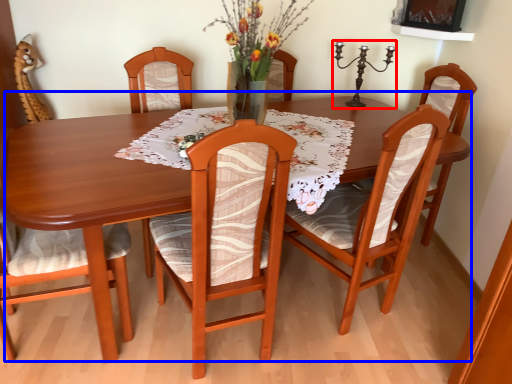
Question: Which object appears farthest to the camera in this image, candle holder (highlighted by a red box) or kitchen & dining room table (highlighted by a blue box)?

Choices:
 (A) candle holder
 (B) kitchen & dining room table

Answer: (A)